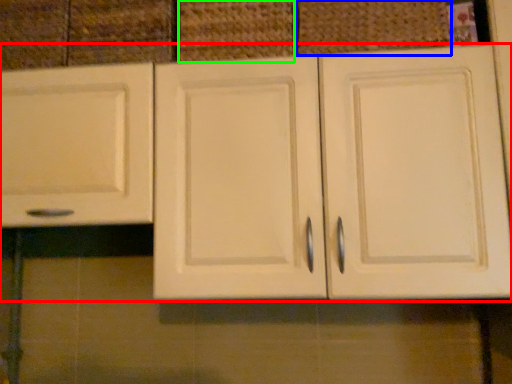
Question: Based on their relative distances, which object is farther from cabinetry (highlighted by a red box)? Choose from basket (highlighted by a blue box) and basket (highlighted by a green box).

Choices:
 (A) basket
 (B) basket

Answer: (A)